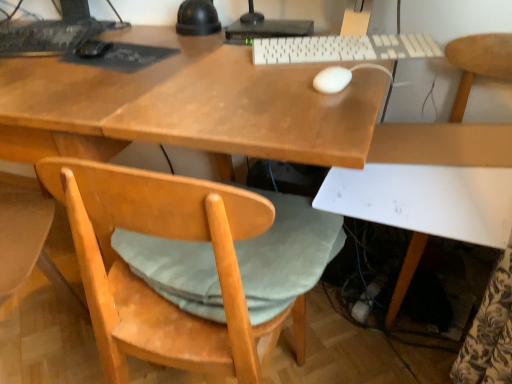
In order to click on free space in front of black matte mouse at upper left, which ranks as the first mouse in top-to-bottom order in this screenshot , I will do `click(71, 75)`.